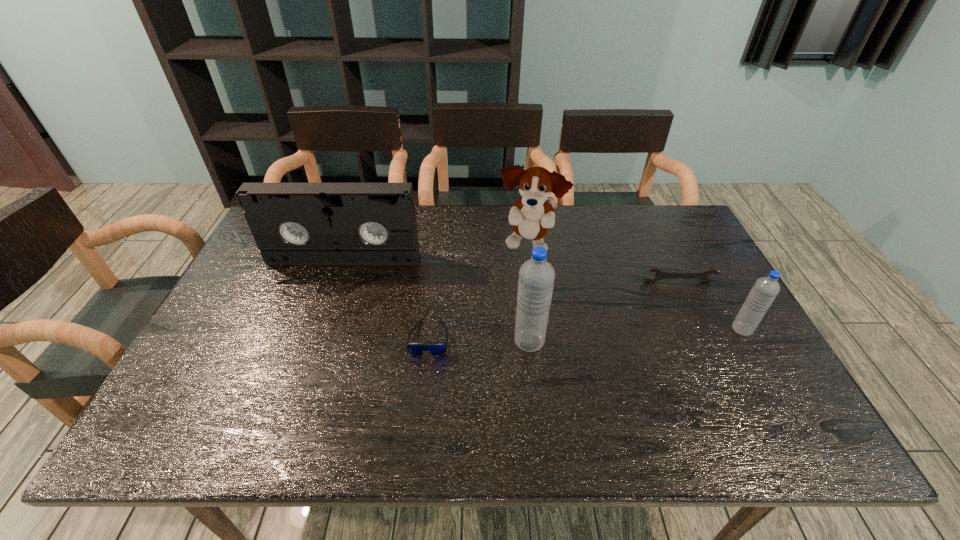
Identify the location of free location located on the side of the videotape with visible spindles. This screenshot has width=960, height=540. (330, 299).

The image size is (960, 540). Identify the location of free space located on the open ends of the fourth nearest object. (723, 376).

The width and height of the screenshot is (960, 540). Identify the location of blank area located on the front-facing side of the sunglasses. (425, 377).

At what (x,y) coordinates should I click in order to perform the action: click on object that is at the far edge. Please return your answer as a coordinate pair (x, y). This screenshot has height=540, width=960. Looking at the image, I should click on (531, 216).

Where is `object located in the left edge section of the desktop`? This screenshot has height=540, width=960. object located in the left edge section of the desktop is located at coordinates (292, 223).

Where is `water bottle that is positioned at the right edge`? This screenshot has height=540, width=960. water bottle that is positioned at the right edge is located at coordinates (765, 289).

This screenshot has height=540, width=960. What are the coordinates of `wrench at the right edge` in the screenshot? It's located at (660, 274).

In the image, there is a desktop. Where is `vacant space at the far edge`? Image resolution: width=960 pixels, height=540 pixels. vacant space at the far edge is located at coordinates (608, 220).

The image size is (960, 540). In order to click on free region at the near edge of the desktop in this screenshot , I will do `click(614, 383)`.

Locate an element on the screen. free space at the left edge of the desktop is located at coordinates (225, 322).